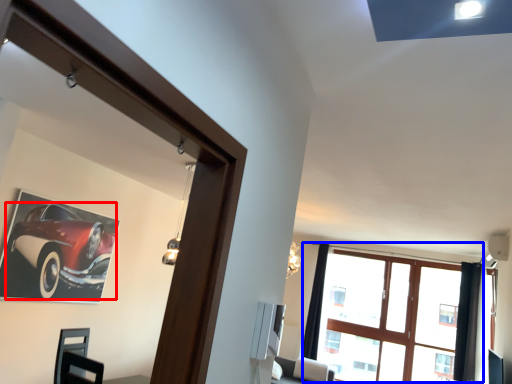
Question: Which object appears farthest to the camera in this image, car (highlighted by a red box) or window (highlighted by a blue box)?

Choices:
 (A) car
 (B) window

Answer: (B)